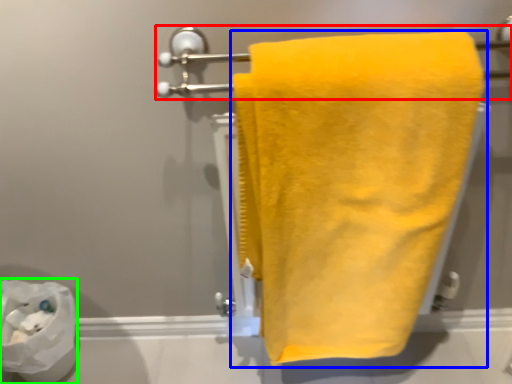
Question: Considering the real-world distances, which object is farthest from towel bar (highlighted by a red box)? towel (highlighted by a blue box) or toilet paper (highlighted by a green box)?

Choices:
 (A) towel
 (B) toilet paper

Answer: (B)